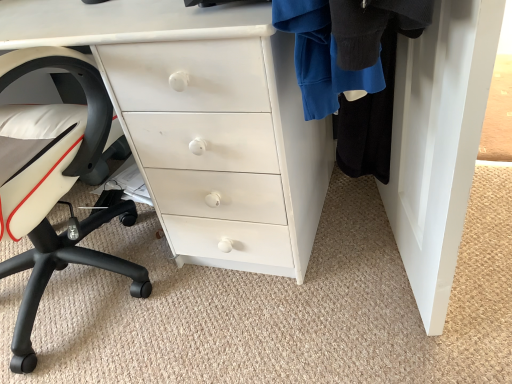
Question: From the image's perspective, would you say white painted wood chest of drawers at center is positioned over white matte chair at left?

Choices:
 (A) no
 (B) yes

Answer: (B)

Question: From the image's perspective, is white painted wood chest of drawers at center under white matte chair at left?

Choices:
 (A) no
 (B) yes

Answer: (A)

Question: Is white painted wood chest of drawers at center positioned in front of white matte chair at left?

Choices:
 (A) yes
 (B) no

Answer: (B)

Question: Does white painted wood chest of drawers at center have a larger size compared to white matte chair at left?

Choices:
 (A) yes
 (B) no

Answer: (A)

Question: Is white painted wood chest of drawers at center aimed at white matte chair at left?

Choices:
 (A) no
 (B) yes

Answer: (B)

Question: Is white painted wood chest of drawers at center wider than white matte chair at left?

Choices:
 (A) yes
 (B) no

Answer: (B)

Question: Is white matte chair at left not near white painted wood chest of drawers at center?

Choices:
 (A) yes
 (B) no

Answer: (B)

Question: Is white painted wood chest of drawers at center inside white matte chair at left?

Choices:
 (A) yes
 (B) no

Answer: (B)

Question: Does white matte chair at left have a larger size compared to white painted wood chest of drawers at center?

Choices:
 (A) no
 (B) yes

Answer: (A)

Question: Does white matte chair at left appear on the left side of white painted wood chest of drawers at center?

Choices:
 (A) yes
 (B) no

Answer: (A)

Question: Considering the relative sizes of white matte chair at left and white painted wood chest of drawers at center in the image provided, is white matte chair at left thinner than white painted wood chest of drawers at center?

Choices:
 (A) no
 (B) yes

Answer: (A)

Question: Does white matte chair at left have a lesser height compared to white painted wood chest of drawers at center?

Choices:
 (A) no
 (B) yes

Answer: (A)

Question: Is point (10, 64) closer or farther from the camera than point (179, 77)?

Choices:
 (A) farther
 (B) closer

Answer: (B)